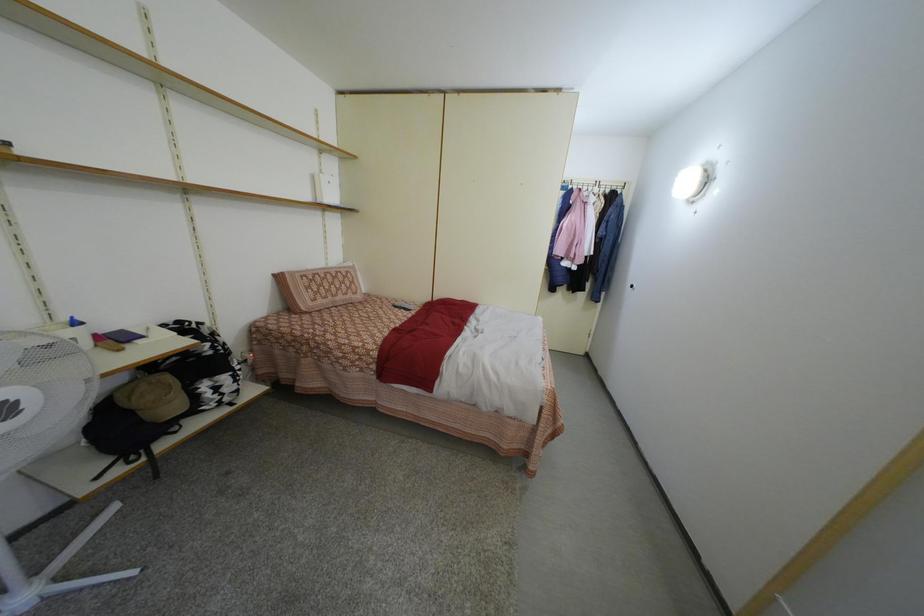
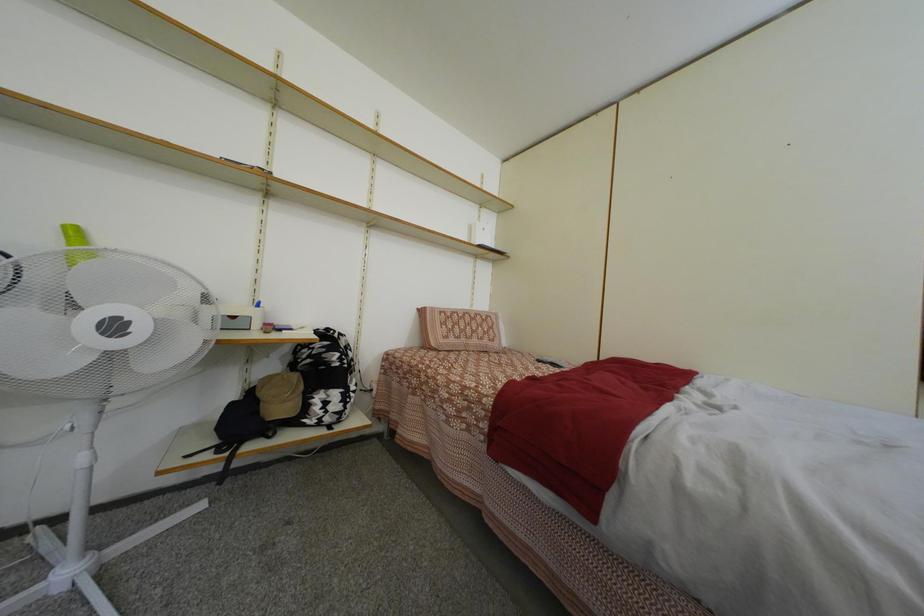
The images are taken continuously from a first-person perspective. In which direction is your viewpoint rotating?

The camera's rotation is toward left-up.